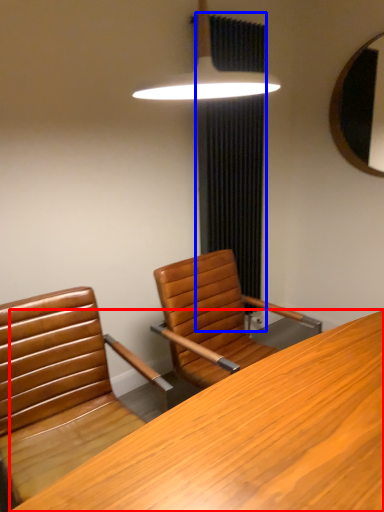
Question: Which object is further to the camera taking this photo, desk (highlighted by a red box) or curtain (highlighted by a blue box)?

Choices:
 (A) desk
 (B) curtain

Answer: (B)